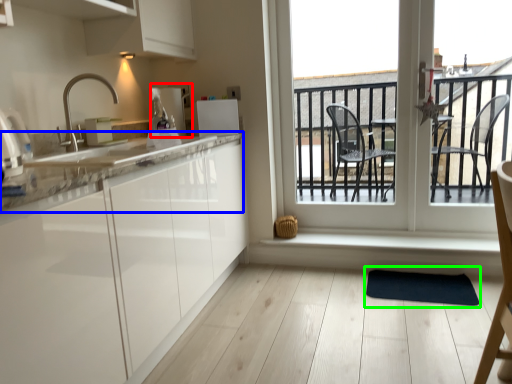
Question: Considering the real-world distances, which object is farthest from appliance (highlighted by a red box)? countertop (highlighted by a blue box) or yoga mat (highlighted by a green box)?

Choices:
 (A) countertop
 (B) yoga mat

Answer: (B)